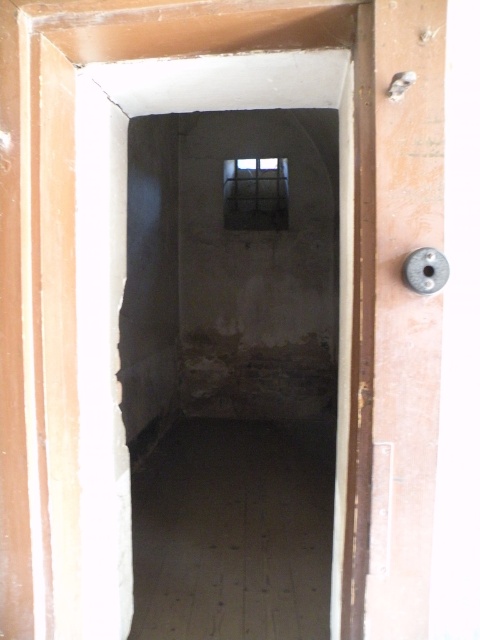
Is smooth concrete basement at center below wooden door knob at right?

Correct, smooth concrete basement at center is located below wooden door knob at right.

Is point (217, 490) in front of point (406, 628)?

That is False.

What are the coordinates of `smooth concrete basement at center` in the screenshot? It's located at (233, 531).

Who is lower down, smooth concrete basement at center or transparent glass window at center?

smooth concrete basement at center is lower down.

This screenshot has width=480, height=640. Find the location of `smooth concrete basement at center`. smooth concrete basement at center is located at coordinates (233, 531).

Is point (147, 604) positioned before point (249, 163)?

Yes, point (147, 604) is closer to viewer.

In order to click on smooth concrete basement at center in this screenshot , I will do `click(233, 531)`.

Between point (394, 593) and point (251, 193), which one is positioned in front?

Point (394, 593) is in front.

Does wooden door knob at right appear over transparent glass window at center?

No.

Between point (391, 586) and point (236, 170), which one is positioned behind?

The point (236, 170) is more distant.

At what (x,y) coordinates should I click in order to perform the action: click on wooden door knob at right. Please return your answer as a coordinate pair (x, y). The image size is (480, 640). Looking at the image, I should click on (405, 317).